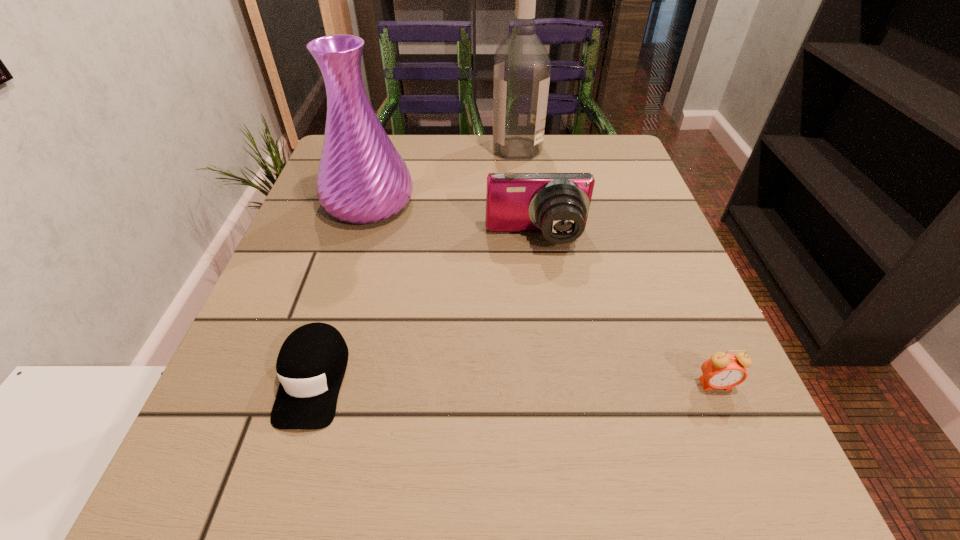
At what (x,y) coordinates should I click in order to perform the action: click on vacant space located 0.120m on the right of the fourth shortest object. Please return your answer as a coordinate pair (x, y). The height and width of the screenshot is (540, 960). Looking at the image, I should click on (469, 203).

Where is `free space located on the front-facing side of the camera`? The width and height of the screenshot is (960, 540). free space located on the front-facing side of the camera is located at coordinates (x=548, y=327).

In order to click on vacant space located on the face of the second shortest object in this screenshot , I will do `click(759, 486)`.

Locate an element on the screen. The height and width of the screenshot is (540, 960). vacant space located on the front-facing side of the cap is located at coordinates (273, 513).

Identify the location of liquor located at the far edge. (522, 68).

You are a GUI agent. You are given a task and a screenshot of the screen. Output one action in this format:
    pyautogui.click(x=<x>, y=<y>)
    Task: Click on the vase at the far edge
    Image resolution: width=960 pixels, height=540 pixels.
    Given the screenshot: What is the action you would take?
    pyautogui.click(x=362, y=178)

Identify the location of vase that is at the left edge. (362, 178).

Locate an element on the screen. This screenshot has height=540, width=960. cap present at the left edge is located at coordinates (311, 364).

At what (x,y) coordinates should I click in order to perform the action: click on camera located at the right edge. Please return your answer as a coordinate pair (x, y). This screenshot has height=540, width=960. Looking at the image, I should click on (557, 204).

I want to click on alarm clock present at the right edge, so click(722, 371).